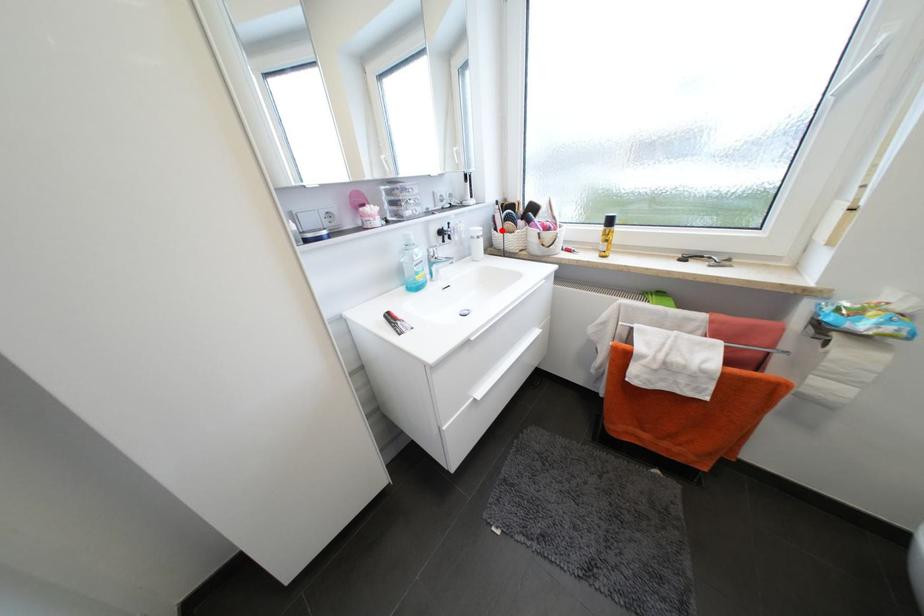
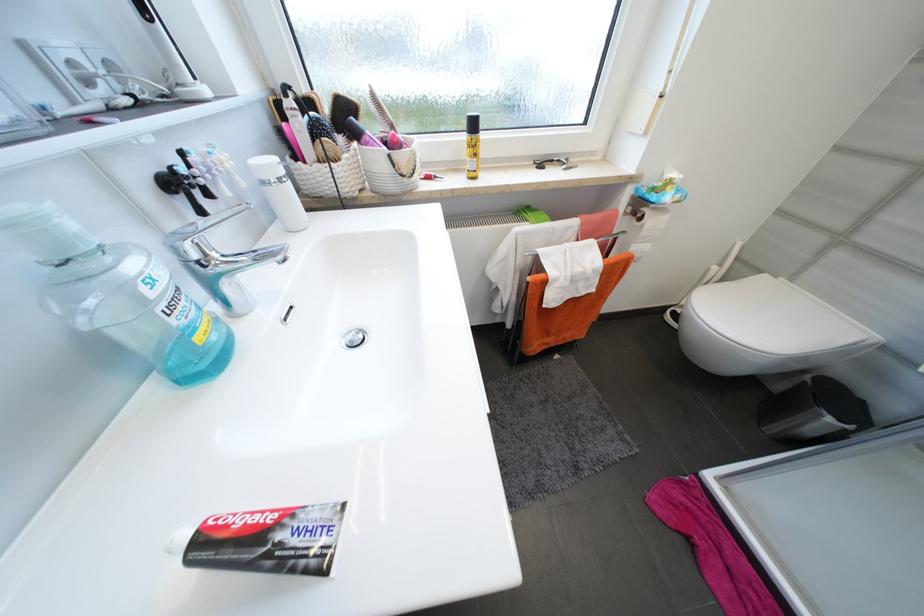
Where in the second image is the point corresponding to the highlighted location from the first image?

(304, 158)